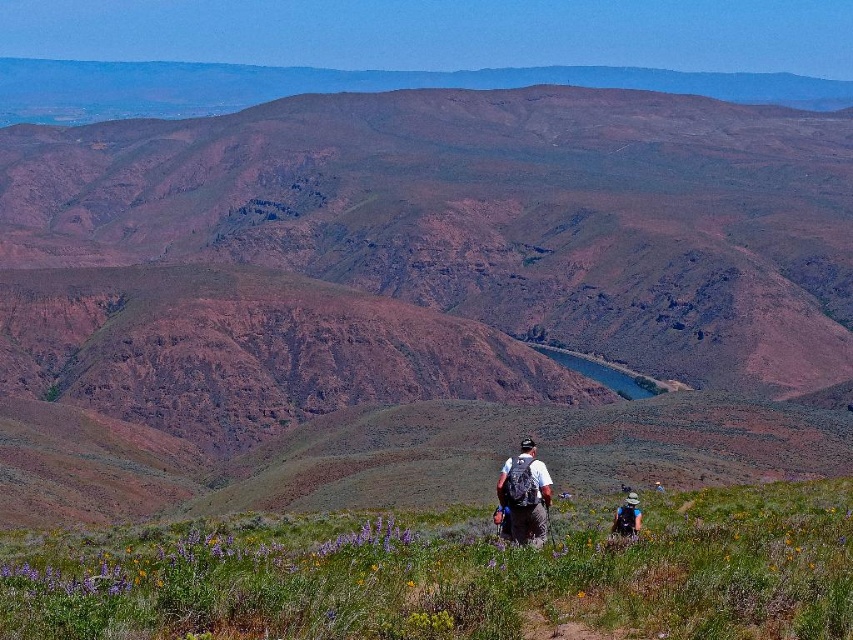
You are a hiker who wants to check both the matte black backpack at center and the matte gray backpack at lower center. Which backpack should you approach first if you want to check the one that is on the left side?

The matte black backpack at center is positioned on the left side of the matte gray backpack at lower center, so you should approach the matte black backpack at center first.

You are a hiker standing at the edge of the grassy field with wildflowers. You want to reach the brown rocky mountain at center. Which direction should you head relative to the matte gray backpack at lower center?

The brown rocky mountain at center is located to the left of the matte gray backpack at lower center, so you should head to the left relative to the backpack to reach it.